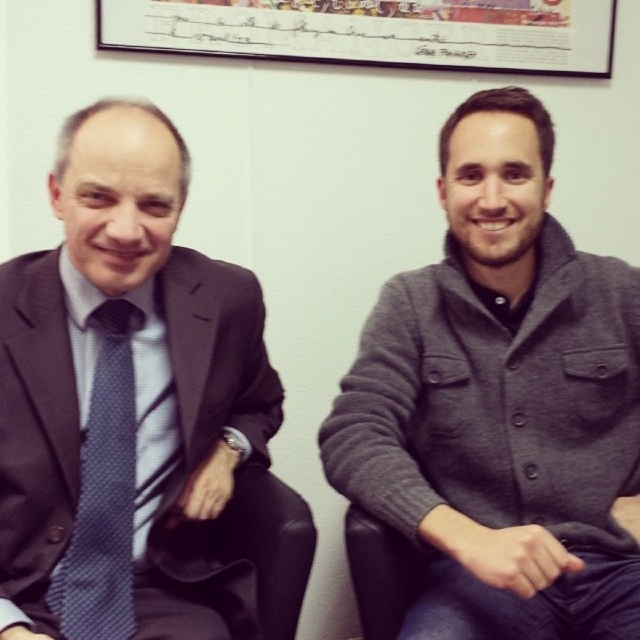
Is point (618, 312) in front of point (97, 452)?

No, (618, 312) is further to viewer.

Which is more to the right, gray woolen sweater at right or matte blue tie at left?

gray woolen sweater at right

Where is `gray woolen sweater at right`? This screenshot has width=640, height=640. gray woolen sweater at right is located at coordinates (500, 401).

Who is shorter, framed paper at upper center or matte blue tie at left?

framed paper at upper center is shorter.

Who is positioned more to the left, framed paper at upper center or matte blue tie at left?

From the viewer's perspective, matte blue tie at left appears more on the left side.

Is point (502, 13) farther from viewer compared to point (104, 332)?

Yes, it is.

Where is `framed paper at upper center`? The height and width of the screenshot is (640, 640). framed paper at upper center is located at coordinates (372, 33).

This screenshot has width=640, height=640. Identify the location of matte black suit at left. (120, 387).

Consider the image. Does matte black suit at left appear over framed paper at upper center?

No, matte black suit at left is not above framed paper at upper center.

Is point (4, 596) positioned in front of point (100, 20)?

That is True.

I want to click on matte black suit at left, so click(120, 387).